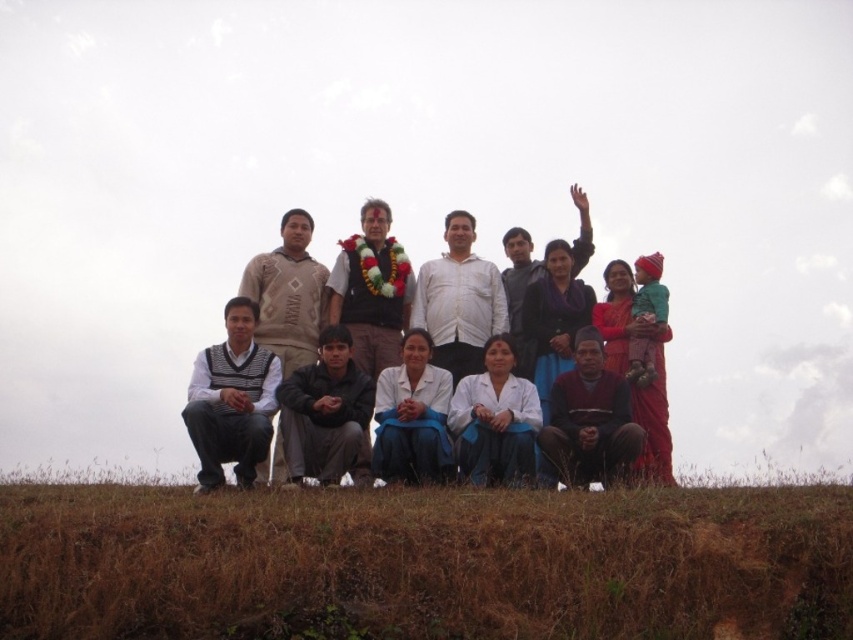
You are a photographer trying to capture a photo of the white cotton shirt at center and the black cotton sweater at lower center. If your camera has a maximum focus range of 40 feet, will you be able to capture both subjects clearly in the same frame?

The white cotton shirt at center and black cotton sweater at lower center are 43.75 feet apart from each other. Since the camera can only focus up to 40 feet, the distance between them exceeds the maximum focus range. Therefore, you won t be able to capture both subjects clearly in the same frame.

You are a photographer standing at a certain distance from a group of people on a grassy hill. You want to take a closeup photo of the white cotton shirt at center. Based on the distance provided, is it feasible to capture a clear closeup shot without moving closer?

The white cotton shirt at center is 80.62 meters away from the viewer. At this distance, capturing a clear closeup shot without moving closer would be challenging unless using a high quality telephoto lens capable of zooming in effectively from such a distance.